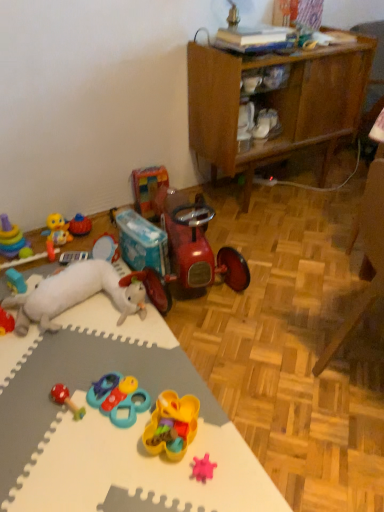
I want to click on vacant space in between pink rubber star at lower center, which is counted as the 1th toy, starting from the right, and rubberized red and green toy at lower left, the 7th toy from the left, so click(x=135, y=438).